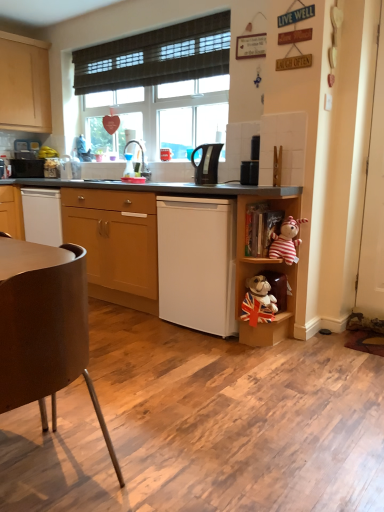
Locate an element on the screen. Image resolution: width=384 pixels, height=512 pixels. vacant point to the left of wooden shelf at right, acting as the second shelf starting from the top is located at coordinates (213, 344).